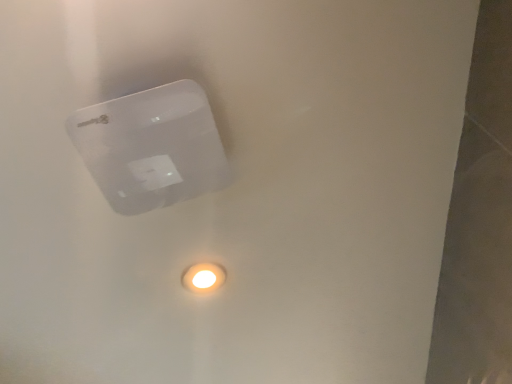
What do you see at coordinates (151, 147) in the screenshot? The image size is (512, 384). I see `white plastic power plug at upper left` at bounding box center [151, 147].

Find the location of a particular element. This screenshot has height=384, width=512. white plastic power plug at upper left is located at coordinates (151, 147).

Locate an element on the screen. The height and width of the screenshot is (384, 512). white plastic power plug at upper left is located at coordinates (151, 147).